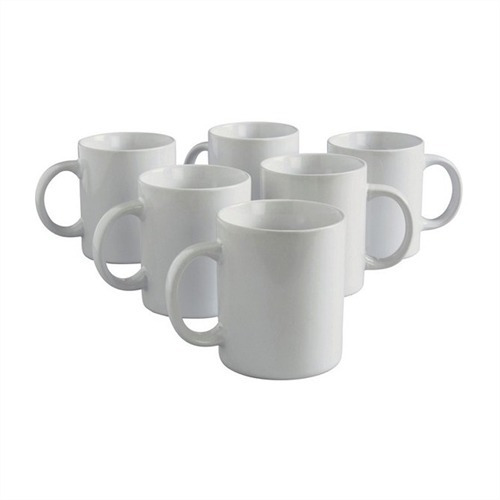
Locate an element on the screen. This screenshot has height=500, width=500. mugs is located at coordinates (114, 169), (179, 214), (272, 269), (248, 151), (329, 186), (390, 167).